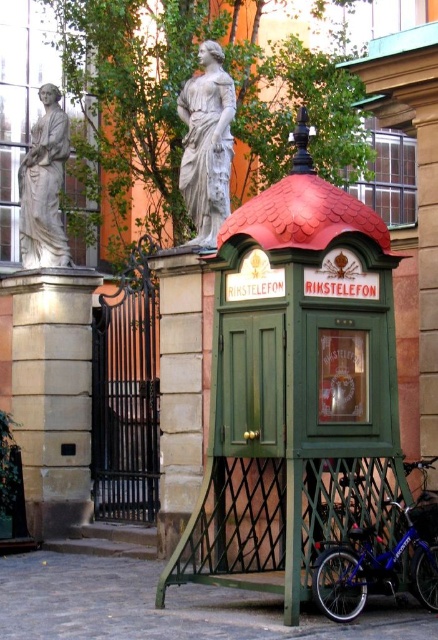
Between point (410, 570) and point (60, 109), which one is positioned in front?

Point (410, 570) is in front.

Does blue metallic bicycle at lower right appear over white marble statue at left?

Incorrect, blue metallic bicycle at lower right is not positioned above white marble statue at left.

Identify the location of blue metallic bicycle at lower right. This screenshot has width=438, height=640. (378, 563).

Does blue metallic bicycle at lower right have a greater height compared to white marble statue at upper center?

Incorrect, blue metallic bicycle at lower right's height is not larger of white marble statue at upper center's.

Can you confirm if blue metallic bicycle at lower right is bigger than white marble statue at upper center?

Actually, blue metallic bicycle at lower right might be smaller than white marble statue at upper center.

The image size is (438, 640). I want to click on blue metallic bicycle at lower right, so click(x=378, y=563).

Who is taller, green wood telephone booth at center or blue metallic bicycle at lower right?

With more height is green wood telephone booth at center.

Between point (244, 305) and point (399, 552), which one is positioned behind?

The point (244, 305) is behind.

Find the location of a particular element. green wood telephone booth at center is located at coordinates pyautogui.click(x=295, y=387).